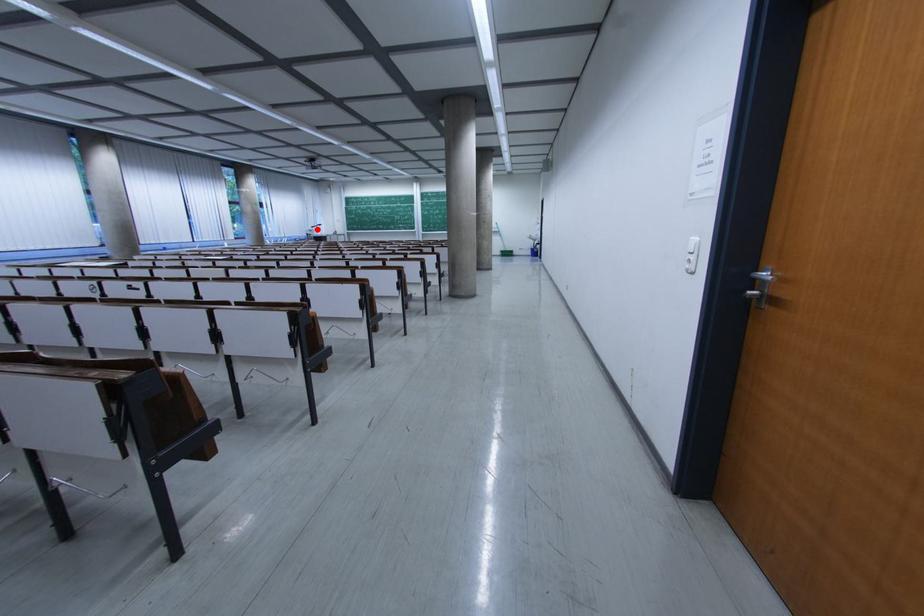
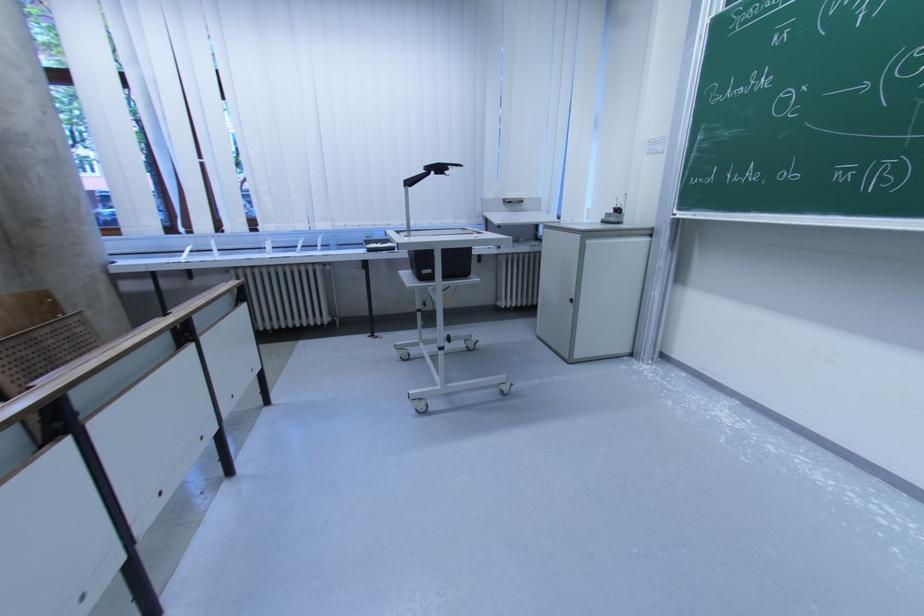
Find the pixel in the second image that matches the highlighted location in the first image.

(415, 185)